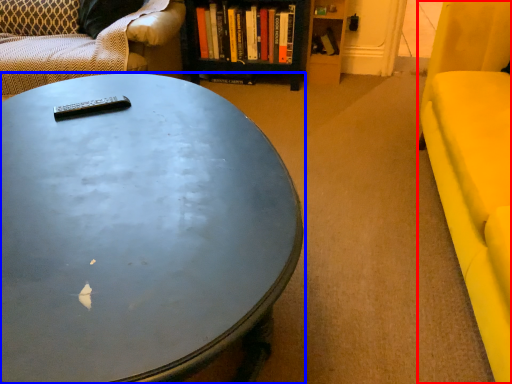
Question: Which object is closer to the camera taking this photo, armchair (highlighted by a red box) or coffee table (highlighted by a blue box)?

Choices:
 (A) armchair
 (B) coffee table

Answer: (B)